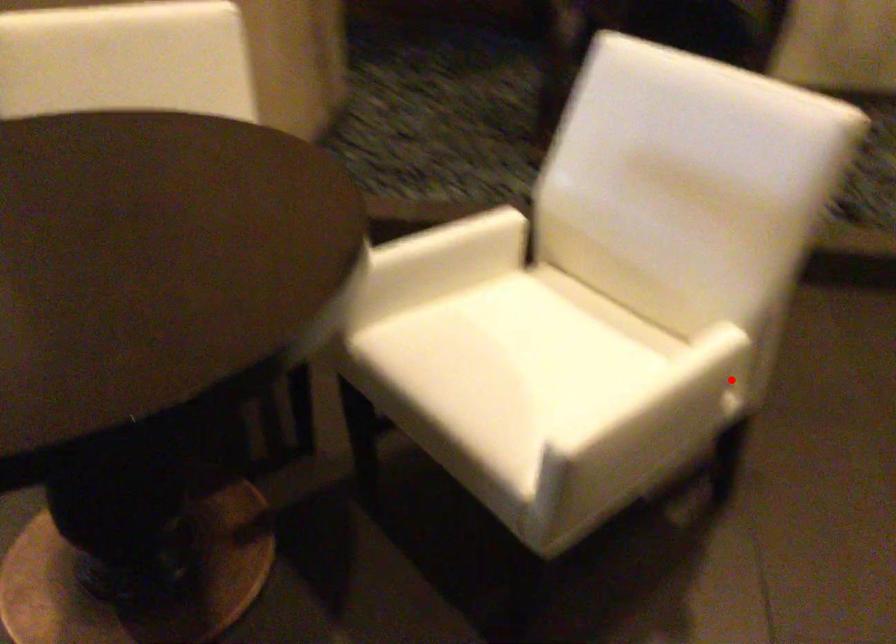
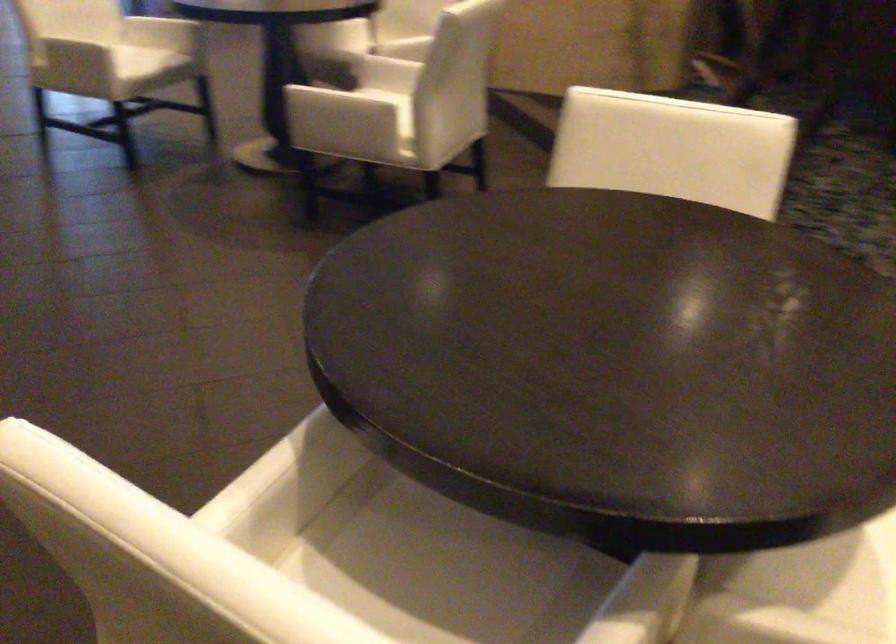
Where in the second image is the point corresponding to the highlighted location from the first image?

(371, 109)